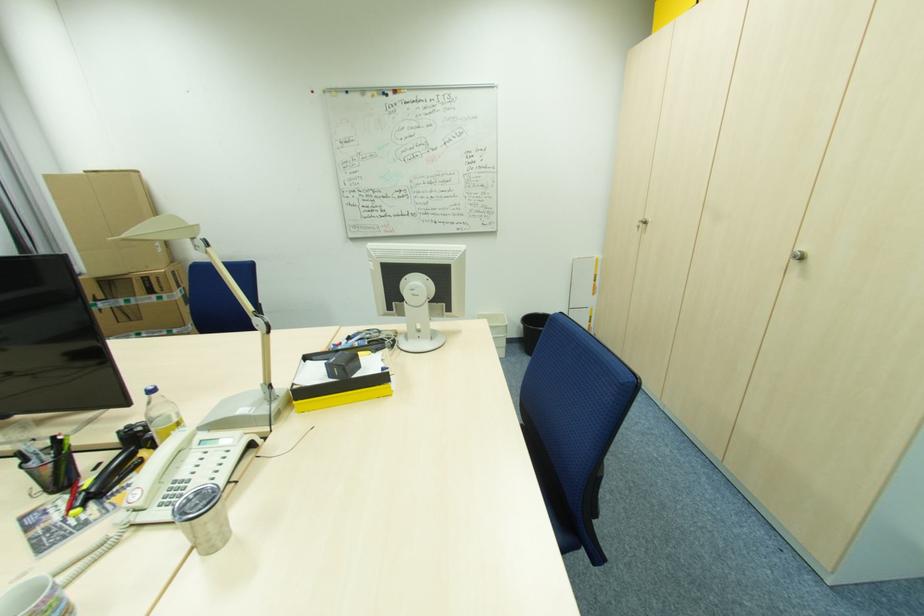
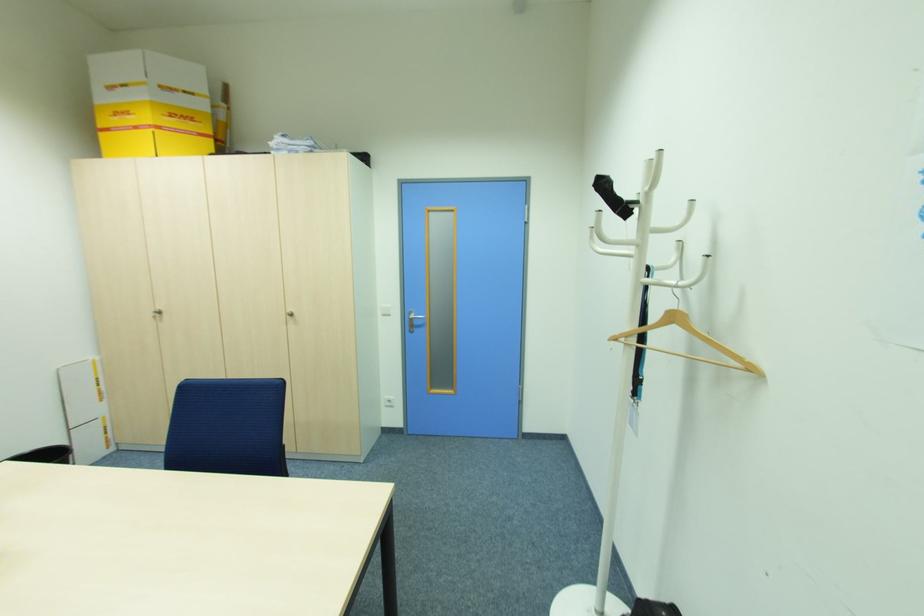
Question: The camera is either moving clockwise (left) or counter-clockwise (right) around the object. The first image is from the beginning of the video and the second image is from the end. Is the camera moving left or right when shooting the video?

Choices:
 (A) Left
 (B) Right

Answer: (A)